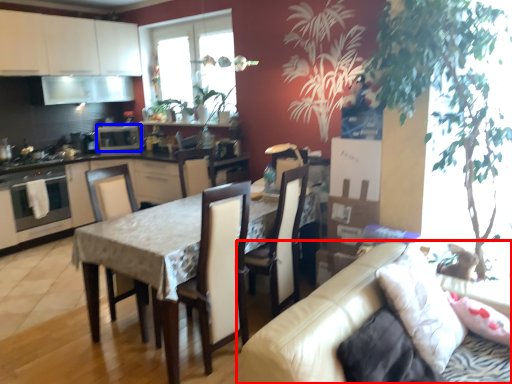
Question: Which point is closer to the camera, studio couch (highlighted by a red box) or appliance (highlighted by a blue box)?

Choices:
 (A) studio couch
 (B) appliance

Answer: (A)